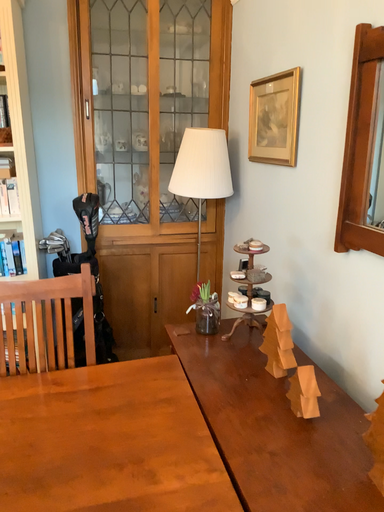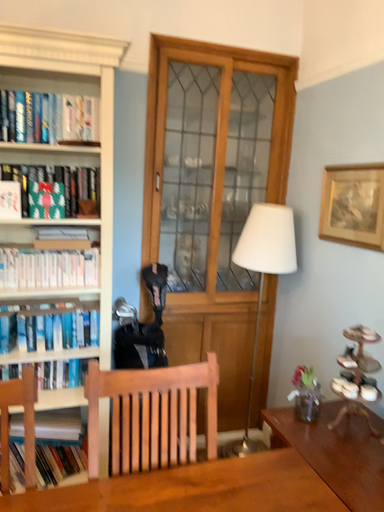
Question: Which way did the camera rotate in the video?

Choices:
 (A) rotated downward
 (B) rotated upward

Answer: (B)